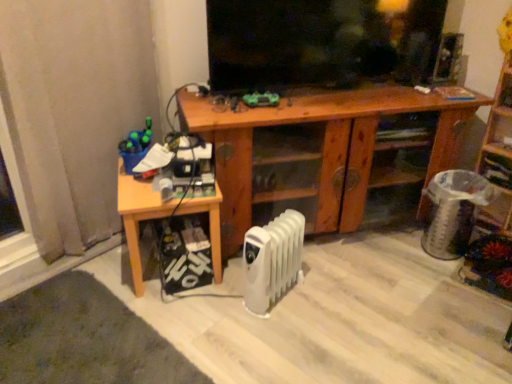
Question: Is wooden cabinet at center wider or thinner than green matte toy at center, placed as the first toy when sorted from top to bottom?

Choices:
 (A) thin
 (B) wide

Answer: (B)

Question: Visually, is wooden cabinet at center positioned to the left or to the right of green matte toy at center, which appears as the 1th toy when viewed from the right?

Choices:
 (A) right
 (B) left

Answer: (A)

Question: Based on their relative distances, which object is farther from the wooden cabinet at center?

Choices:
 (A) wooden bookshelf at right
 (B) black glossy tv at upper center
 (C) matte plastic pen holder at left, which ranks as the first toy in bottom-to-top order
 (D) light wood table at lower left
 (E) green matte toy at center, the 2th toy ordered from the bottom

Answer: (C)

Question: Estimate the real-world distances between objects in this image. Which object is farther from the wooden bookshelf at right?

Choices:
 (A) light wood table at lower left
 (B) green matte toy at center, which appears as the 1th toy when viewed from the right
 (C) black glossy tv at upper center
 (D) wooden cabinet at center
 (E) white plastic radiator at lower center

Answer: (A)